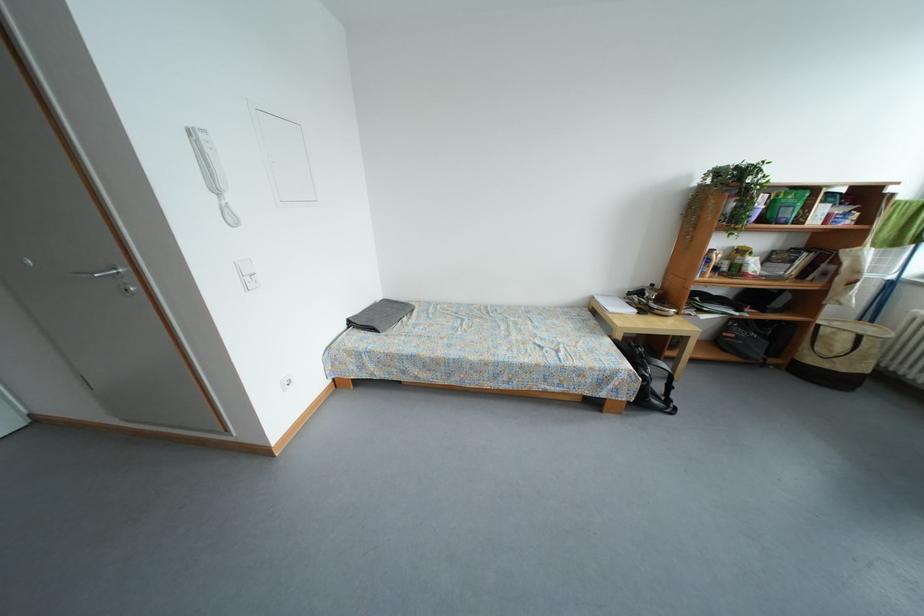
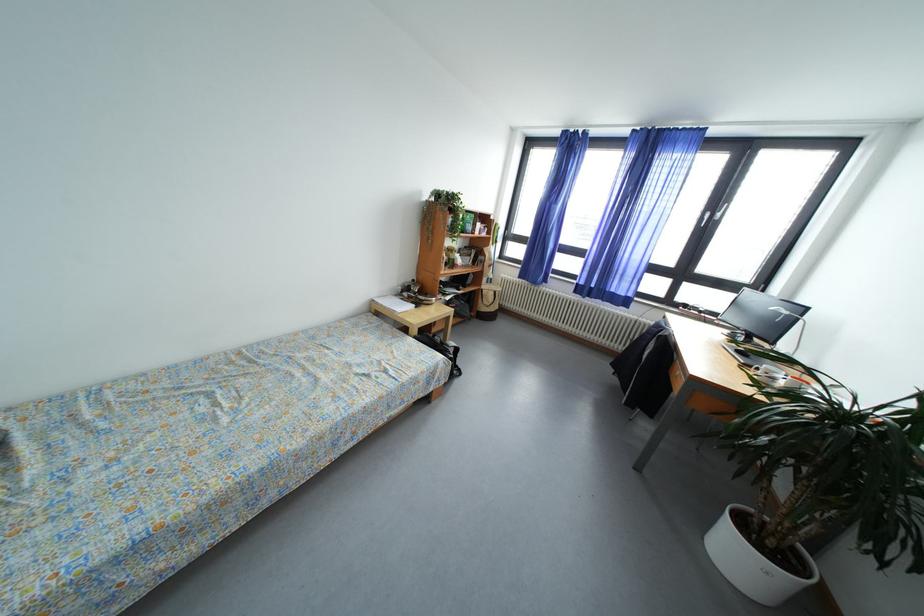
Where in the second image is the point corresponding to pixel 867 342 from the first image?

(502, 297)